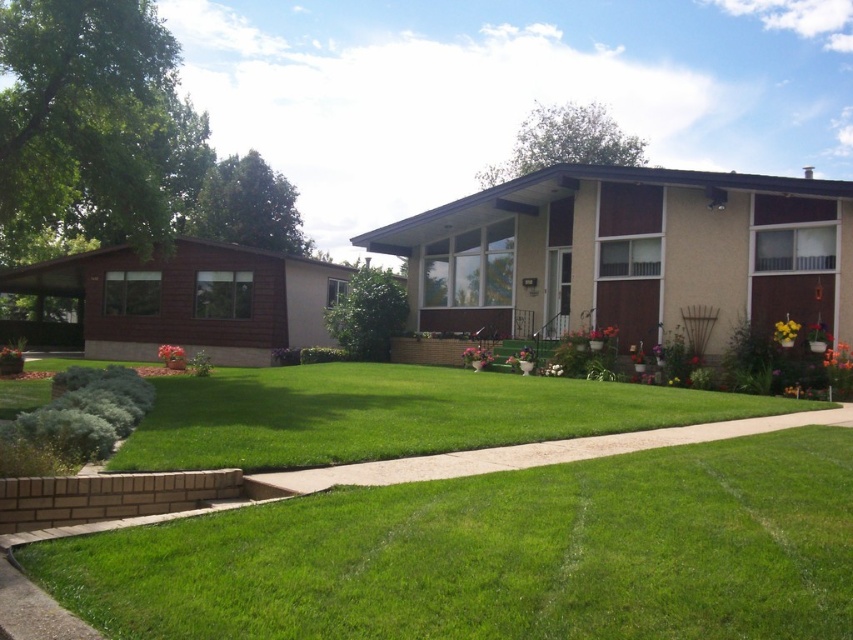
Question: Is orange matte flower at lower right to the left of orange matte flower pot at lower left from the viewer's perspective?

Choices:
 (A) yes
 (B) no

Answer: (B)

Question: Is green concrete sidewalk at center to the left of yellow matte flower at lower right from the viewer's perspective?

Choices:
 (A) yes
 (B) no

Answer: (A)

Question: Which of these objects is positioned closest to the orange matte flower at lower right?

Choices:
 (A) yellow matte flower at lower right
 (B) green grass at lower left
 (C) green lawn at lower center

Answer: (A)

Question: Which object is the farthest from the green grass at lower left?

Choices:
 (A) orange matte flower pot at lower left
 (B) yellow matte flower at lower right
 (C) pink matte flower pot at center

Answer: (A)

Question: From the image, what is the correct spatial relationship of green grass at lower left in relation to orange matte flower at lower right?

Choices:
 (A) right
 (B) left

Answer: (B)

Question: Which point is farther from the camera taking this photo?

Choices:
 (A) (488, 356)
 (B) (289, 476)

Answer: (A)